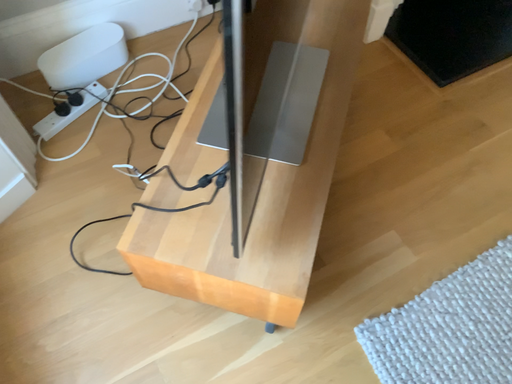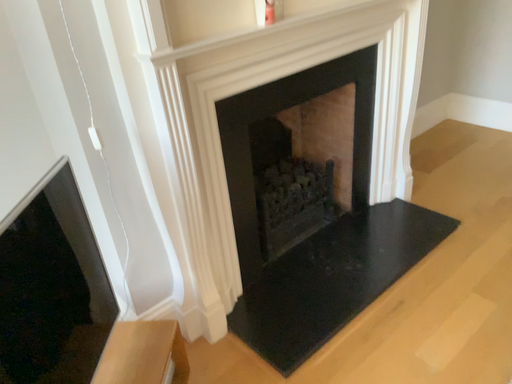
Question: How did the camera likely rotate when shooting the video?

Choices:
 (A) rotated downward
 (B) rotated upward

Answer: (B)